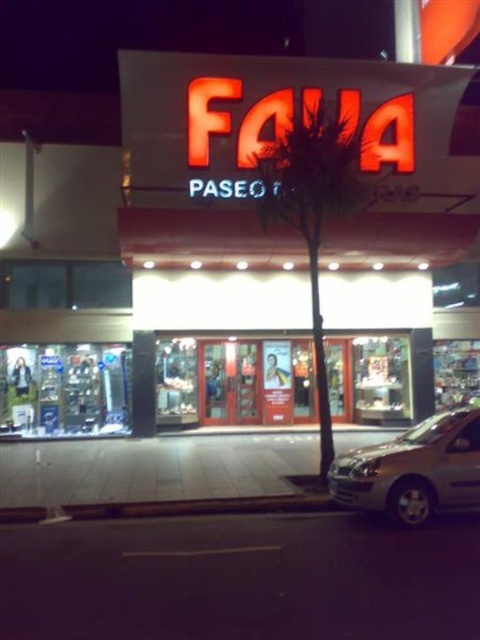
You are a delivery person trying to unload a package from your silver metallic car at lower right. The package is too wide to fit through the glass door entrance at center. What could be the reason?

The glass door entrance at center is thinner than the silver metallic car at lower right, meaning the door is narrower than the car, so the package might be as wide as the car, making it too large to pass through the entrance.